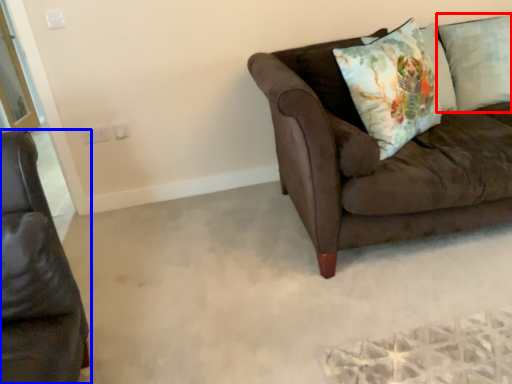
Question: Which object appears farthest to the camera in this image, pillow (highlighted by a red box) or studio couch (highlighted by a blue box)?

Choices:
 (A) pillow
 (B) studio couch

Answer: (A)